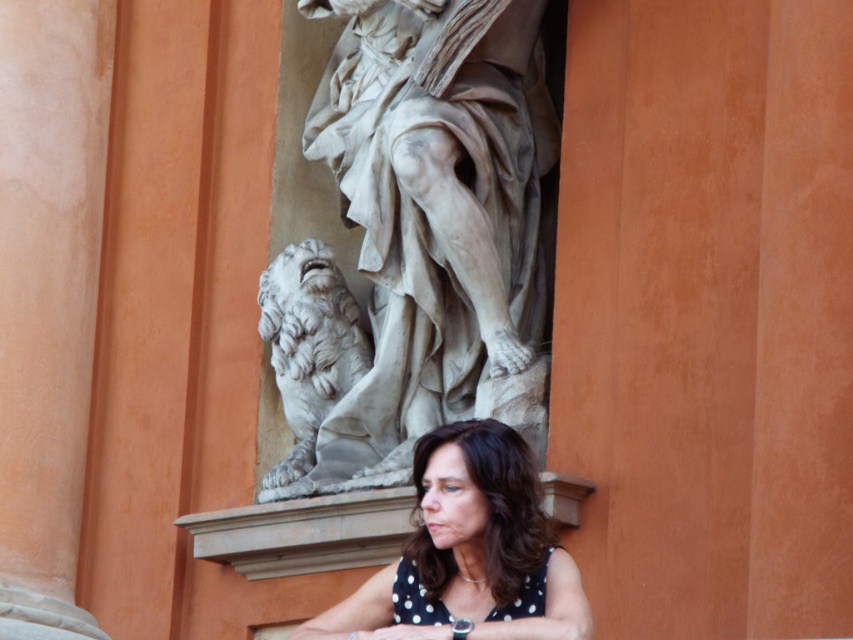
You are an art student analyzing the sculpture in the image. You notice two points marked on the sculpture. The first point is at coordinates point (459, 20) and the second is at point (434, 435). Which point is closer to you?

Point (459, 20) is further to the viewer than point (434, 435), so the second point is closer to you.

Looking at this image, you are an architect analyzing the layout of this building. The point marked at coordinates (430, 221) is part of an important architectural feature. What is the object located at this point?

The point at coordinates (430, 221) corresponds to the white marble statue at center, which is located in the recessed niche of the architectural structure.